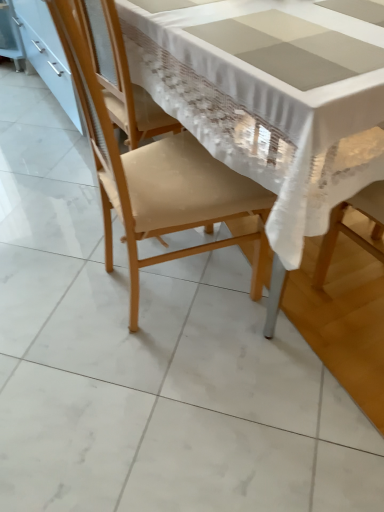
Locate an element on the screen. free spot to the right of matte beige chair at center is located at coordinates (296, 313).